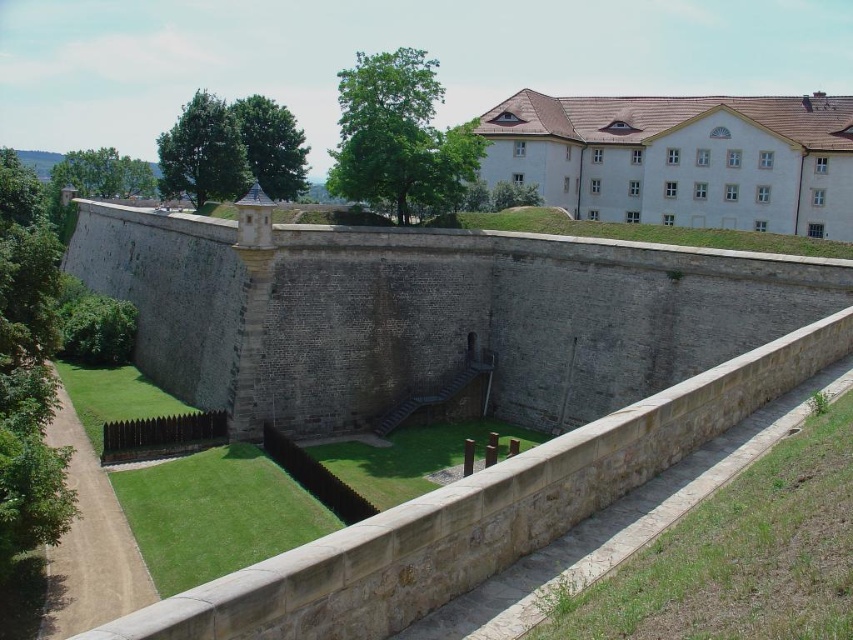
Can you confirm if gray stone wall at center is wider than white stone building at upper right?

Yes.

Can you confirm if gray stone wall at center is bigger than white stone building at upper right?

Indeed, gray stone wall at center has a larger size compared to white stone building at upper right.

The height and width of the screenshot is (640, 853). Describe the element at coordinates (430, 314) in the screenshot. I see `gray stone wall at center` at that location.

The image size is (853, 640). Identify the location of gray stone wall at center. click(430, 314).

Looking at this image, is brown stone moat at lower left to the left of white stone building at upper right from the viewer's perspective?

Yes, brown stone moat at lower left is to the left of white stone building at upper right.

Can you confirm if brown stone moat at lower left is thinner than white stone building at upper right?

Indeed, brown stone moat at lower left has a lesser width compared to white stone building at upper right.

Is point (360, 588) positioned after point (775, 156)?

No, it is in front of (775, 156).

You are a GUI agent. You are given a task and a screenshot of the screen. Output one action in this format:
    pyautogui.click(x=<x>, y=<y>)
    Task: Click on the brown stone moat at lower left
    The image size is (853, 640).
    Given the screenshot: What is the action you would take?
    pyautogui.click(x=480, y=513)

Can you confirm if gray stone wall at center is positioned above brown stone moat at lower left?

Yes, gray stone wall at center is above brown stone moat at lower left.

Between gray stone wall at center and brown stone moat at lower left, which one is positioned higher?

gray stone wall at center is higher up.

The height and width of the screenshot is (640, 853). What do you see at coordinates (430, 314) in the screenshot?
I see `gray stone wall at center` at bounding box center [430, 314].

At what (x,y) coordinates should I click in order to perform the action: click on gray stone wall at center. Please return your answer as a coordinate pair (x, y). Looking at the image, I should click on (430, 314).